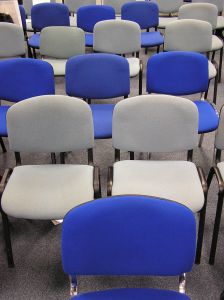
At what (x,y) coordinates should I click in order to perform the action: click on chairs in fifth row. Please return your answer as a coordinate pair (x, y). Looking at the image, I should click on (43, 13), (98, 13), (147, 15), (207, 10).